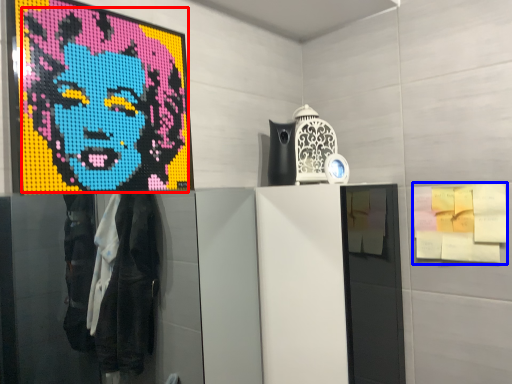
Question: Which object appears farthest to the camera in this image, person (highlighted by a red box) or poster (highlighted by a blue box)?

Choices:
 (A) person
 (B) poster

Answer: (B)